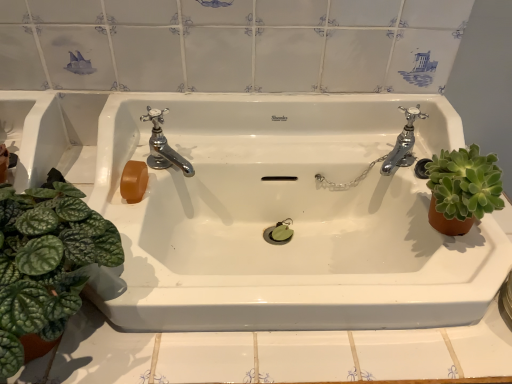
Question: Is green succulent at right, placed as the second houseplant when sorted from left to right, facing away from white glossy sink at center?

Choices:
 (A) yes
 (B) no

Answer: (A)

Question: Considering the relative sizes of green succulent at right, which is the first houseplant from right to left, and white glossy sink at center in the image provided, is green succulent at right, which is the first houseplant from right to left, bigger than white glossy sink at center?

Choices:
 (A) no
 (B) yes

Answer: (A)

Question: Is green succulent at right, which is the first houseplant from right to left, smaller than white glossy sink at center?

Choices:
 (A) yes
 (B) no

Answer: (A)

Question: From a real-world perspective, is green succulent at right, placed as the second houseplant when sorted from left to right, beneath white glossy sink at center?

Choices:
 (A) no
 (B) yes

Answer: (A)

Question: Can white glossy sink at center be found inside green succulent at right, placed as the second houseplant when sorted from left to right?

Choices:
 (A) yes
 (B) no

Answer: (B)

Question: Is green succulent at right, which is the first houseplant from right to left, next to white glossy sink at center and touching it?

Choices:
 (A) yes
 (B) no

Answer: (B)

Question: Is chrome metallic faucet at right, which is counted as the first tap, starting from the right, thinner than green leafy plant at left, the 1th houseplant when ordered from left to right?

Choices:
 (A) yes
 (B) no

Answer: (A)

Question: Can you confirm if chrome metallic faucet at right, which is counted as the first tap, starting from the right, is taller than green leafy plant at left, the 1th houseplant when ordered from left to right?

Choices:
 (A) yes
 (B) no

Answer: (B)

Question: From the image's perspective, would you say chrome metallic faucet at right, which is counted as the first tap, starting from the right, is shown under green leafy plant at left, arranged as the 2th houseplant when viewed from the right?

Choices:
 (A) no
 (B) yes

Answer: (A)

Question: Considering the relative sizes of chrome metallic faucet at right, placed as the second tap when sorted from left to right, and green leafy plant at left, the 1th houseplant when ordered from left to right, in the image provided, is chrome metallic faucet at right, placed as the second tap when sorted from left to right, shorter than green leafy plant at left, the 1th houseplant when ordered from left to right,?

Choices:
 (A) yes
 (B) no

Answer: (A)

Question: Is the depth of chrome metallic faucet at right, placed as the second tap when sorted from left to right, greater than that of green leafy plant at left, arranged as the 2th houseplant when viewed from the right?

Choices:
 (A) yes
 (B) no

Answer: (A)

Question: Is green leafy plant at left, the 1th houseplant when ordered from left to right, completely or partially inside chrome metallic faucet at right, which is counted as the first tap, starting from the right?

Choices:
 (A) yes
 (B) no

Answer: (B)

Question: Is green leafy plant at left, the 1th houseplant when ordered from left to right, wider than chrome metallic faucet at right, placed as the second tap when sorted from left to right?

Choices:
 (A) no
 (B) yes

Answer: (B)